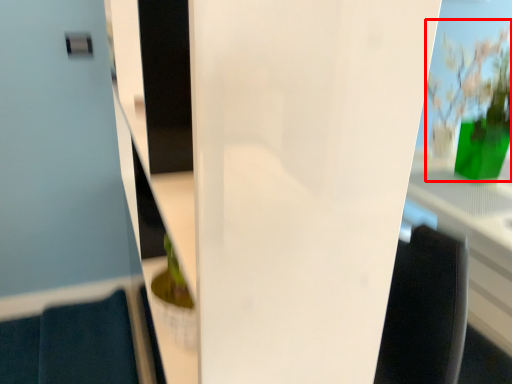
Question: From the image's perspective, what is the correct spatial positioning of floral arrangement (annotated by the red box) in reference to glass door?

Choices:
 (A) below
 (B) above

Answer: (B)